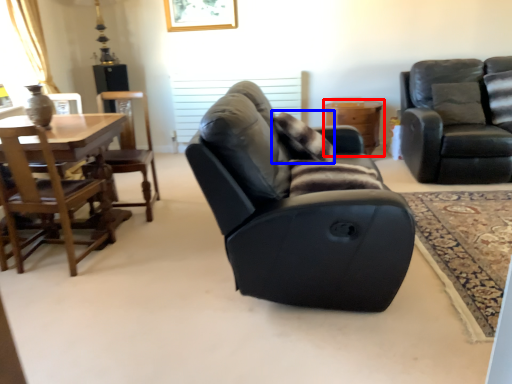
Question: Among these objects, which one is farthest to the camera, table (highlighted by a red box) or pillow (highlighted by a blue box)?

Choices:
 (A) table
 (B) pillow

Answer: (A)